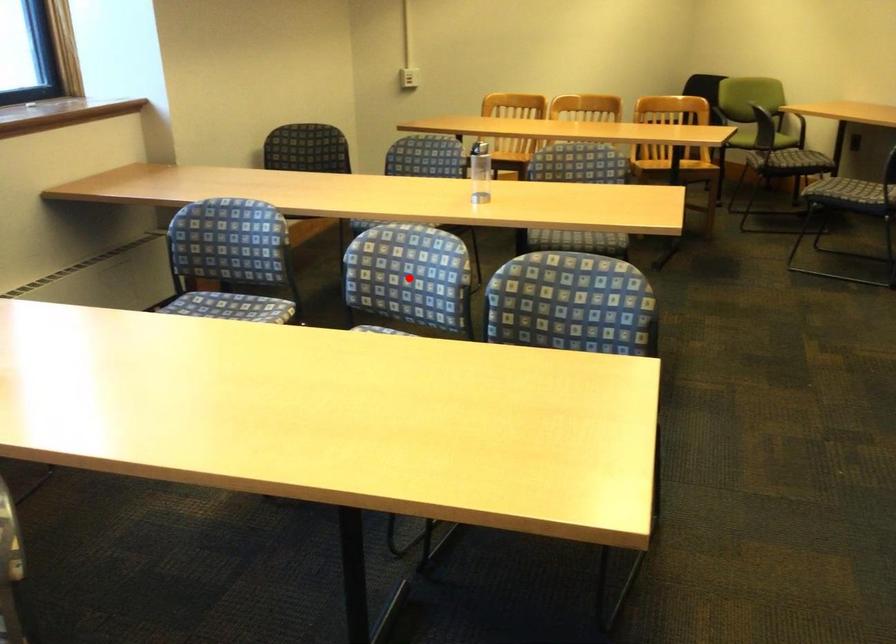
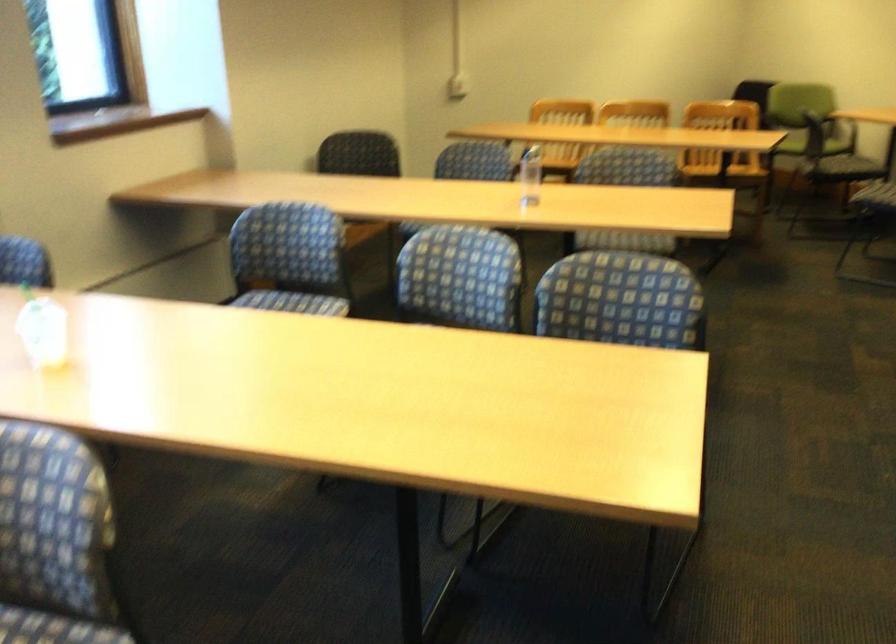
Locate, in the second image, the point that corresponds to the highlighted location in the first image.

(460, 277)